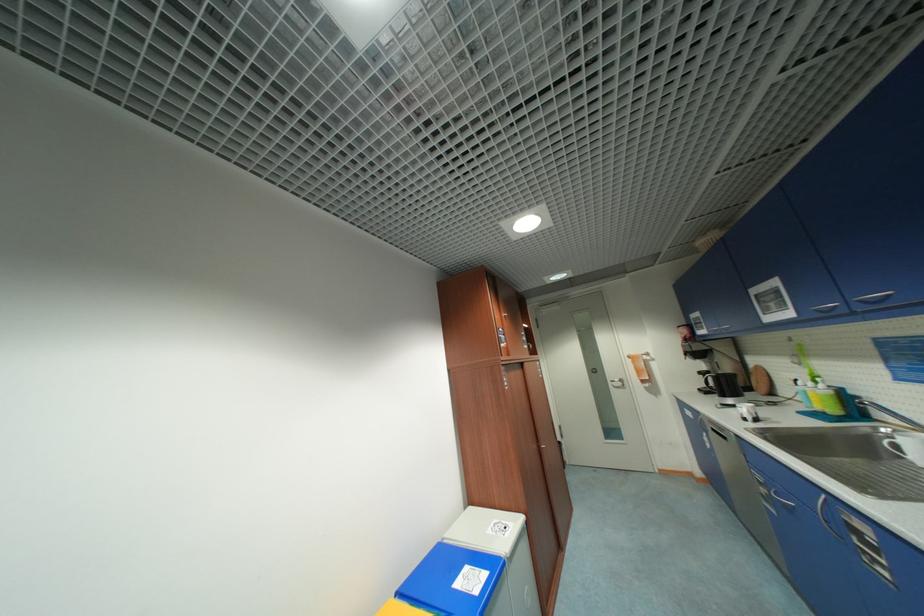
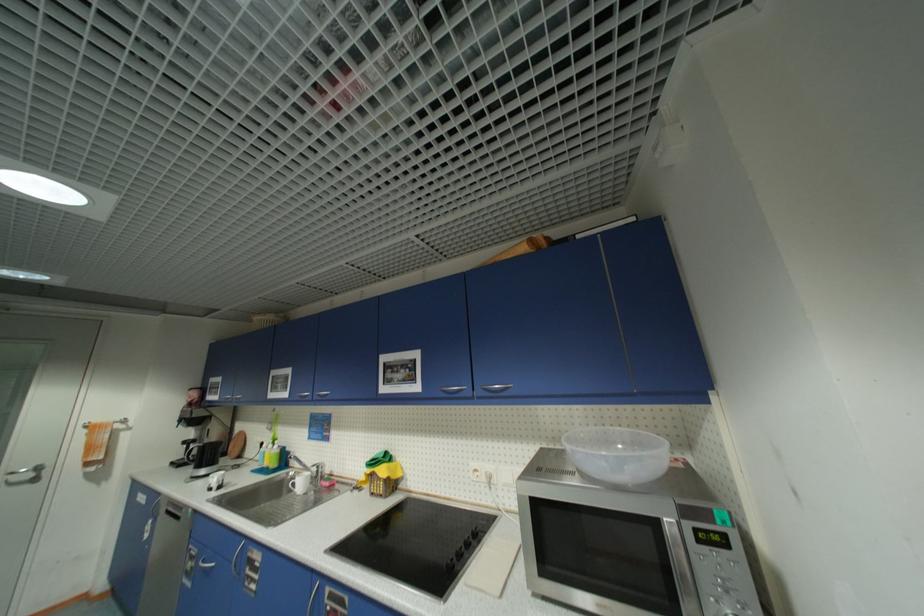
Find the pixel in the second image that matches [882,430] in the first image.

(294, 475)